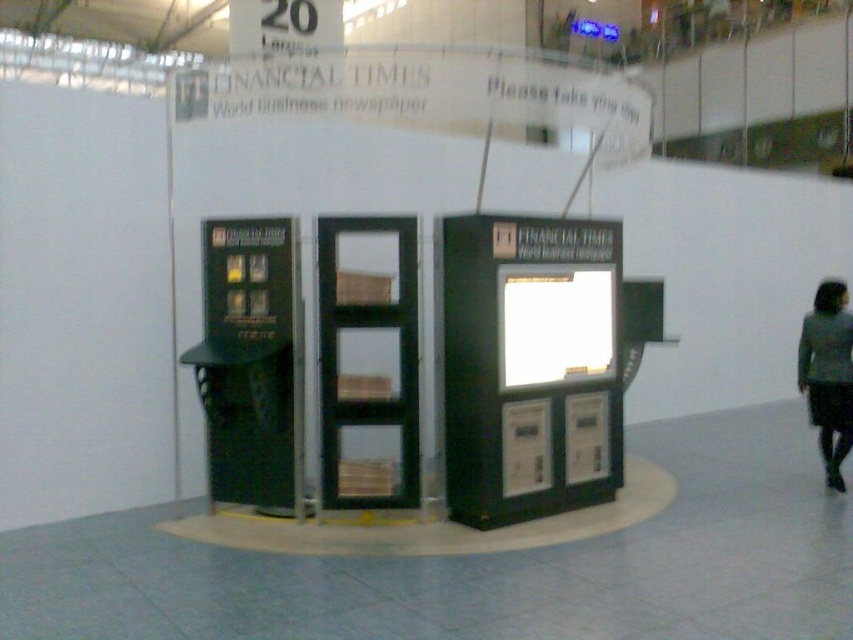
Question: Which point is closer to the camera?

Choices:
 (A) (611, 321)
 (B) (850, 406)

Answer: (A)

Question: Is matte black vending machine at center to the left of gray fabric skirt at lower right from the viewer's perspective?

Choices:
 (A) no
 (B) yes

Answer: (B)

Question: Does matte black vending machine at center appear on the left side of gray fabric skirt at lower right?

Choices:
 (A) no
 (B) yes

Answer: (B)

Question: Which object is closer to the camera taking this photo?

Choices:
 (A) gray fabric skirt at lower right
 (B) matte black vending machine at center

Answer: (B)

Question: Is matte black vending machine at center below gray fabric skirt at lower right?

Choices:
 (A) no
 (B) yes

Answer: (A)